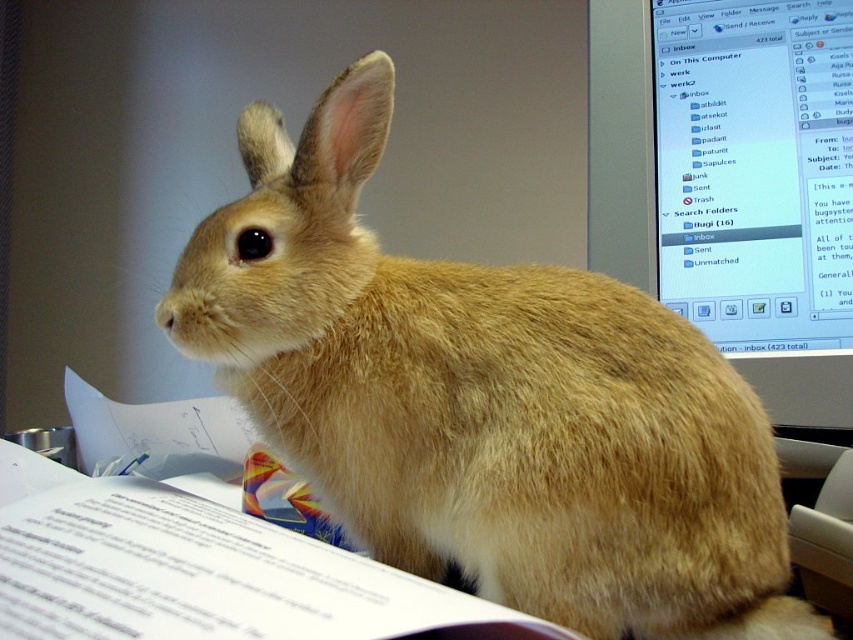
Question: Can you confirm if furry beige rabbit at center is positioned to the left of matte plastic monitor at upper right?

Choices:
 (A) yes
 (B) no

Answer: (A)

Question: Is furry beige rabbit at center further to camera compared to matte plastic monitor at upper right?

Choices:
 (A) yes
 (B) no

Answer: (B)

Question: Is furry beige rabbit at center behind matte plastic monitor at upper right?

Choices:
 (A) no
 (B) yes

Answer: (A)

Question: Which object appears closest to the camera in this image?

Choices:
 (A) matte plastic monitor at upper right
 (B) furry beige rabbit at center

Answer: (B)

Question: Which object is closer to the camera taking this photo?

Choices:
 (A) matte plastic monitor at upper right
 (B) furry beige rabbit at center

Answer: (B)